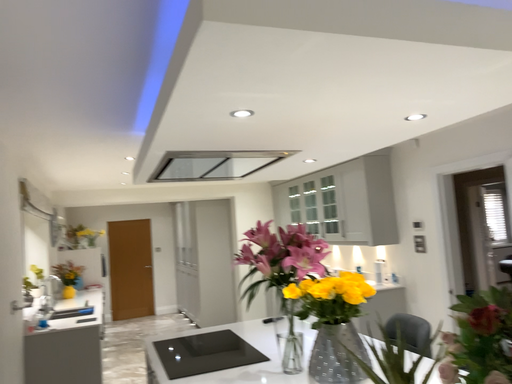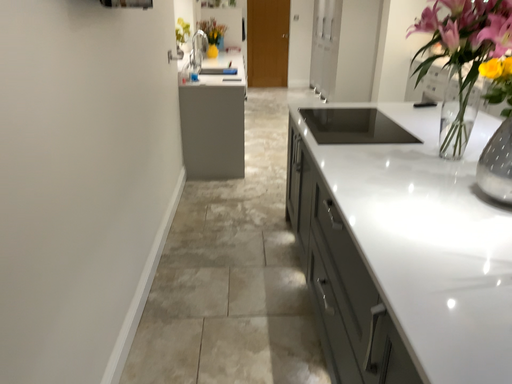
Question: How did the camera likely rotate when shooting the video?

Choices:
 (A) rotated upward
 (B) rotated downward

Answer: (B)